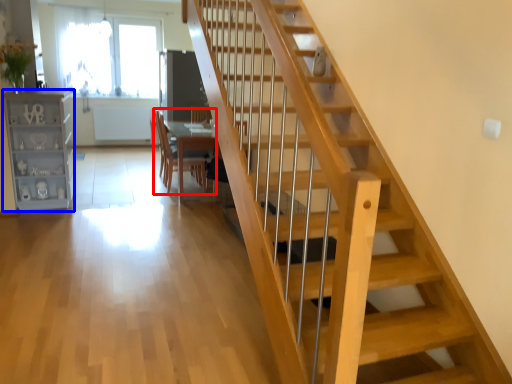
Question: Which object appears farthest to the camera in this image, chair (highlighted by a red box) or bookshelf (highlighted by a blue box)?

Choices:
 (A) chair
 (B) bookshelf

Answer: (A)